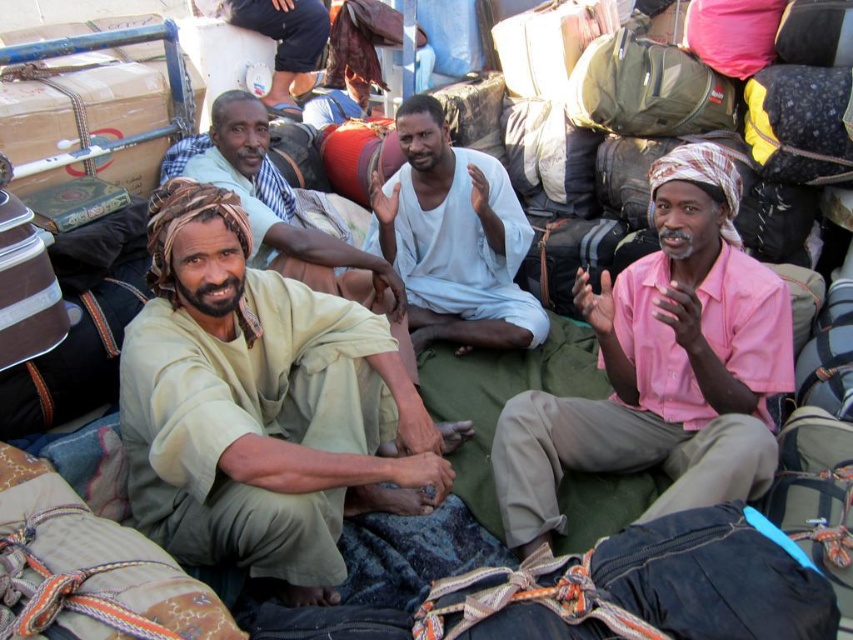
Which is more to the left, beige fabric at center or pink cotton shirt at center?

Positioned to the left is beige fabric at center.

In the scene shown: Can you confirm if beige fabric at center is wider than pink cotton shirt at center?

Correct, the width of beige fabric at center exceeds that of pink cotton shirt at center.

Between point (225, 246) and point (715, 456), which one is positioned in front?

Positioned in front is point (225, 246).

Locate an element on the screen. The image size is (853, 640). beige fabric at center is located at coordinates (260, 406).

Looking at this image, does white cotton shirt at center have a greater width compared to light beige fabric at center?

No, white cotton shirt at center is not wider than light beige fabric at center.

How much distance is there between white cotton shirt at center and light beige fabric at center?

The distance of white cotton shirt at center from light beige fabric at center is 21.33 inches.

Where is `white cotton shirt at center`? white cotton shirt at center is located at coordinates (454, 237).

Who is more forward, (560, 419) or (425, 132)?

Point (560, 419) is in front.

Does point (610, 336) come in front of point (508, 234)?

That is True.

This screenshot has height=640, width=853. What are the coordinates of `pink cotton shirt at center` in the screenshot? It's located at (662, 365).